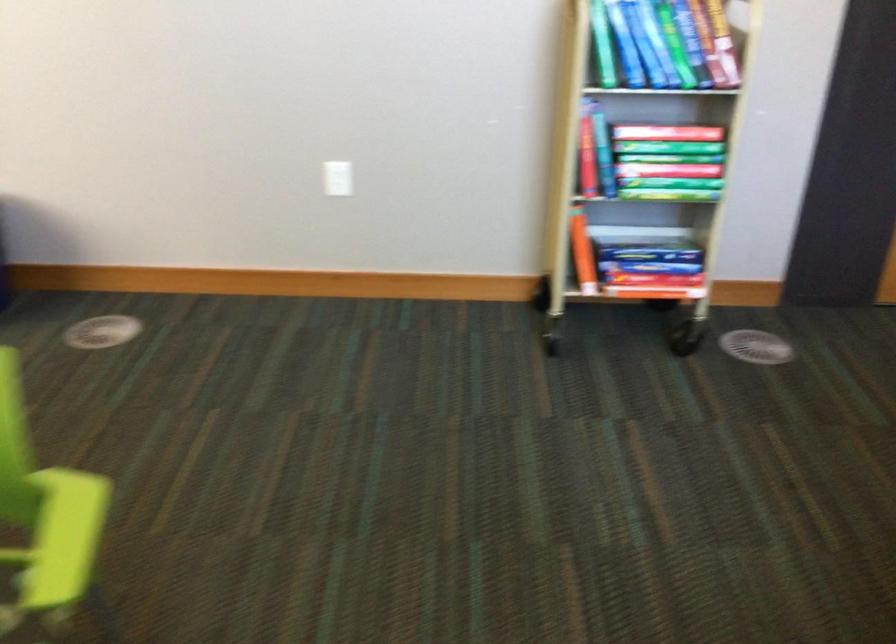
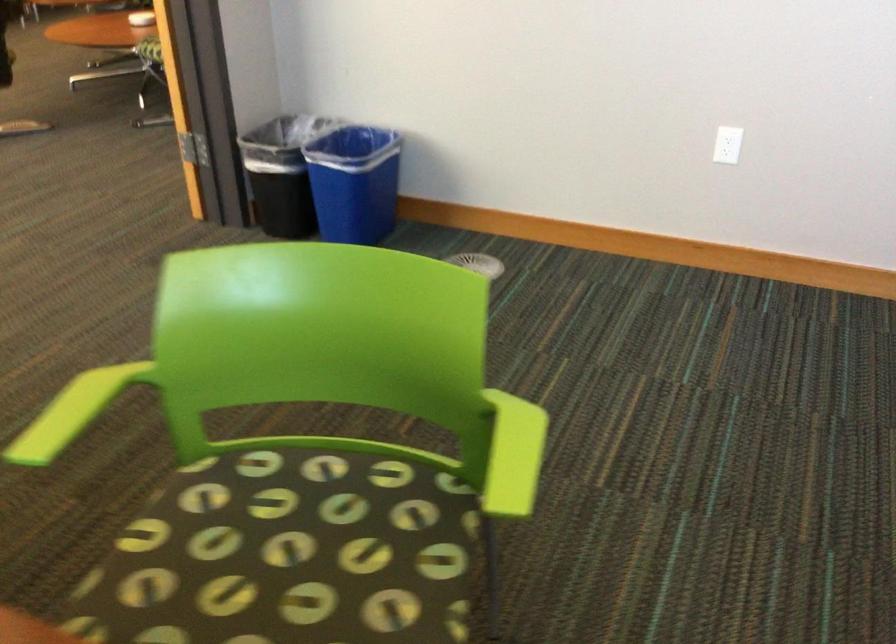
Find the pixel in the second image that matches point 334,178 in the first image.

(728, 144)